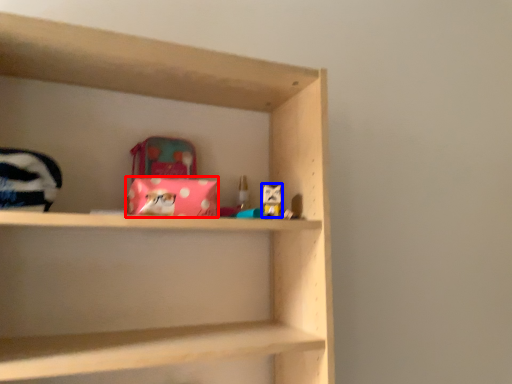
Question: Among these objects, which one is nearest to the camera, material (highlighted by a red box) or toy (highlighted by a blue box)?

Choices:
 (A) material
 (B) toy

Answer: (A)